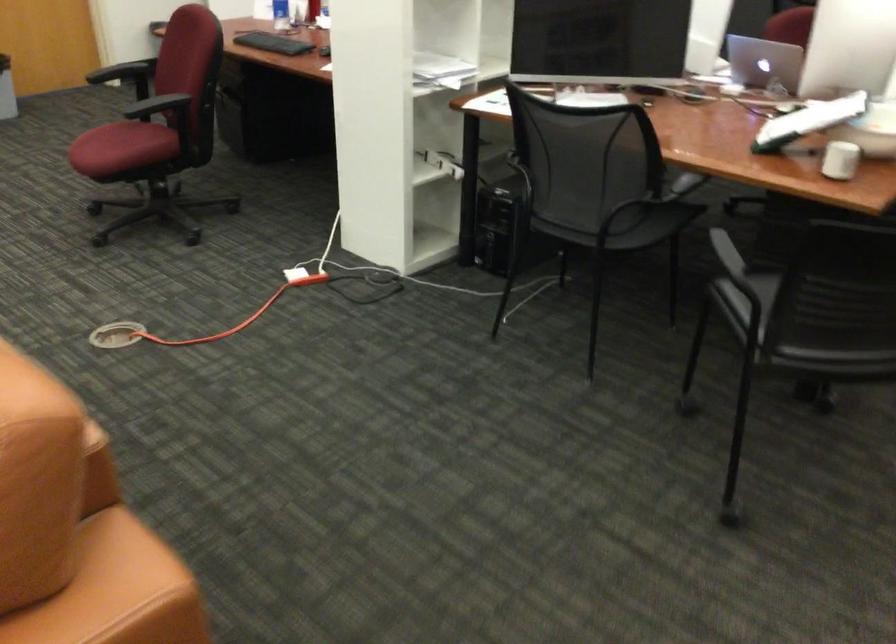
The image size is (896, 644). Find the location of `floor outlet cover`. floor outlet cover is located at coordinates (444, 163).